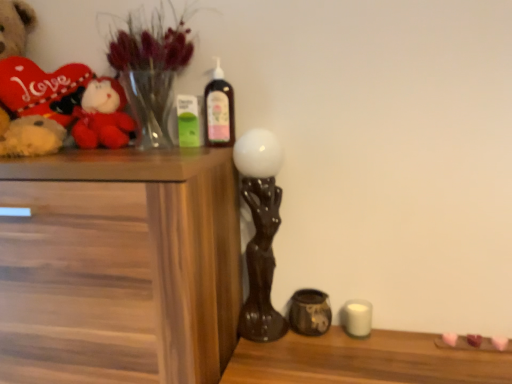
Question: Considering the relative sizes of matte black sculpture at center, the second candle holder from the right, and wooden chest of drawers at left in the image provided, is matte black sculpture at center, the second candle holder from the right, wider than wooden chest of drawers at left?

Choices:
 (A) no
 (B) yes

Answer: (A)

Question: Would you consider matte black sculpture at center, placed as the 1th candle holder when sorted from left to right, to be distant from wooden chest of drawers at left?

Choices:
 (A) no
 (B) yes

Answer: (A)

Question: Does matte black sculpture at center, the second candle holder from the right, lie behind wooden chest of drawers at left?

Choices:
 (A) yes
 (B) no

Answer: (A)

Question: From the image's perspective, would you say matte black sculpture at center, placed as the 1th candle holder when sorted from left to right, is positioned over wooden chest of drawers at left?

Choices:
 (A) yes
 (B) no

Answer: (A)

Question: Considering the relative sizes of matte black sculpture at center, the second candle holder from the right, and wooden chest of drawers at left in the image provided, is matte black sculpture at center, the second candle holder from the right, shorter than wooden chest of drawers at left?

Choices:
 (A) yes
 (B) no

Answer: (A)

Question: Is translucent glass vase at upper left inside or outside of wooden chest of drawers at left?

Choices:
 (A) outside
 (B) inside

Answer: (A)

Question: In the image, is translucent glass vase at upper left positioned in front of or behind wooden chest of drawers at left?

Choices:
 (A) front
 (B) behind

Answer: (B)

Question: From the image's perspective, relative to wooden chest of drawers at left, is translucent glass vase at upper left above or below?

Choices:
 (A) below
 (B) above

Answer: (B)

Question: Is point (113, 56) positioned closer to the camera than point (136, 286)?

Choices:
 (A) farther
 (B) closer

Answer: (A)

Question: Choose the correct answer: Is translucent glass vase at upper left inside velvet plush toy at left or outside it?

Choices:
 (A) inside
 (B) outside

Answer: (B)

Question: In terms of size, does translucent glass vase at upper left appear bigger or smaller than velvet plush toy at left?

Choices:
 (A) big
 (B) small

Answer: (A)

Question: In terms of height, does translucent glass vase at upper left look taller or shorter compared to velvet plush toy at left?

Choices:
 (A) tall
 (B) short

Answer: (A)

Question: From the image's perspective, is translucent glass vase at upper left located above or below velvet plush toy at left?

Choices:
 (A) below
 (B) above

Answer: (B)

Question: Is matte black sculpture at center, placed as the 1th candle holder when sorted from left to right, inside the boundaries of translucent glass vase at upper left, or outside?

Choices:
 (A) inside
 (B) outside

Answer: (B)

Question: Is matte black sculpture at center, placed as the 1th candle holder when sorted from left to right, in front of or behind translucent glass vase at upper left in the image?

Choices:
 (A) front
 (B) behind

Answer: (B)